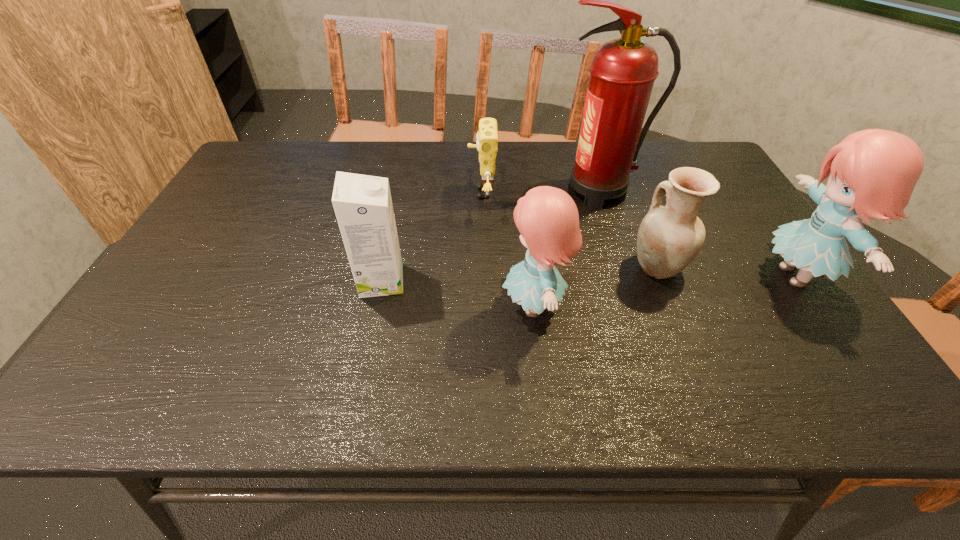
You are a GUI agent. You are given a task and a screenshot of the screen. Output one action in this format:
    pyautogui.click(x=<x>, y=<y>)
    Task: Click on the third object from left to right
    The image size is (960, 540).
    Given the screenshot: What is the action you would take?
    pyautogui.click(x=547, y=218)

Find the location of a particular element. the shorter doll is located at coordinates (547, 218).

Locate an element on the screen. The image size is (960, 540). the right doll is located at coordinates (872, 173).

Locate an element on the screen. the rightmost object is located at coordinates (872, 173).

Locate an element on the screen. the tallest object is located at coordinates (623, 71).

Locate an element on the screen. This screenshot has height=540, width=960. sponge is located at coordinates (487, 137).

This screenshot has width=960, height=540. What are the coordinates of `the fifth object from right to left` in the screenshot? It's located at (487, 137).

Image resolution: width=960 pixels, height=540 pixels. In order to click on pottery in this screenshot , I will do `click(669, 237)`.

What are the coordinates of `the leftmost object` in the screenshot? It's located at (363, 206).

Locate an element on the screen. vacant space positioned on the front-facing side of the left doll is located at coordinates (475, 306).